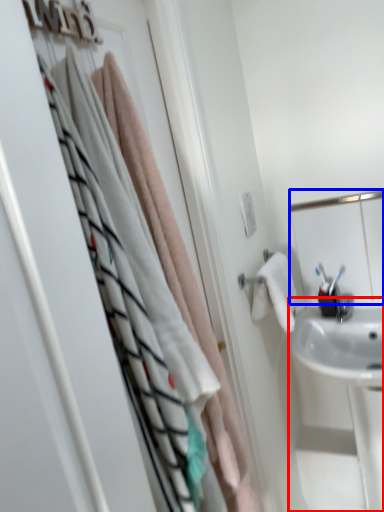
Question: Which of the following is the farthest to the observer, sink (highlighted by a red box) or mirror (highlighted by a blue box)?

Choices:
 (A) sink
 (B) mirror

Answer: (B)